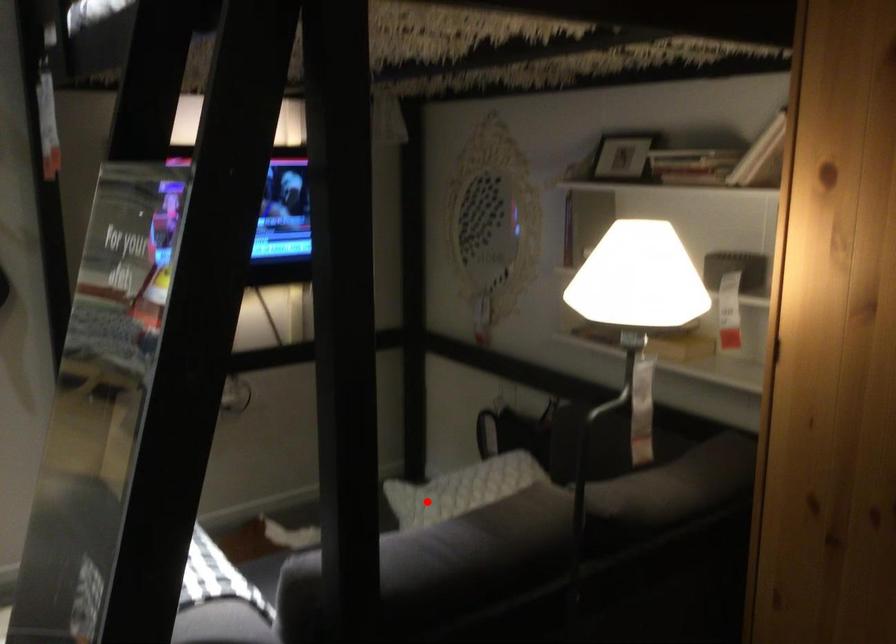
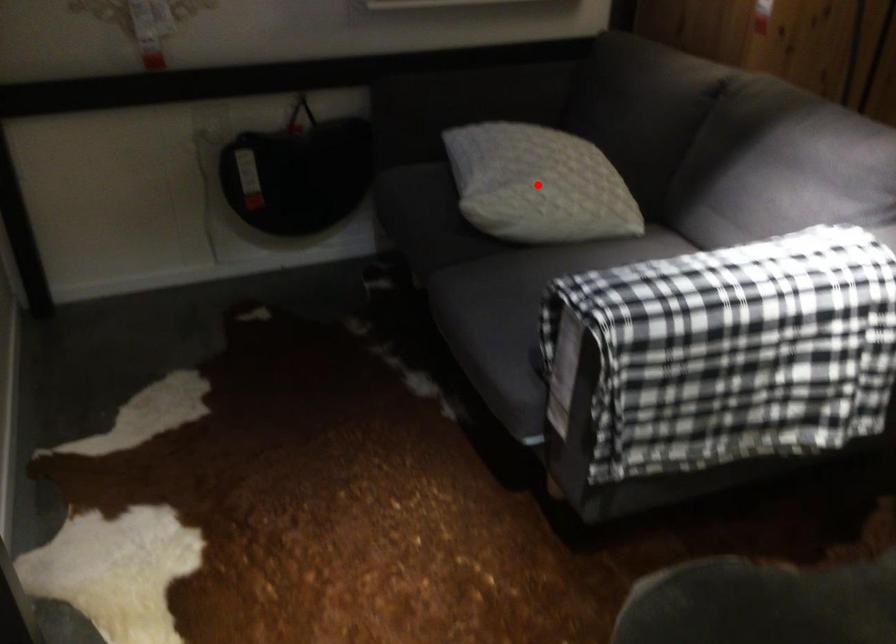
I am providing you with two images of the same scene from different viewpoints. A red point is marked on the first image and another point is marked on the second image. Is the red point in image1 aligned with the point shown in image2?

Yes